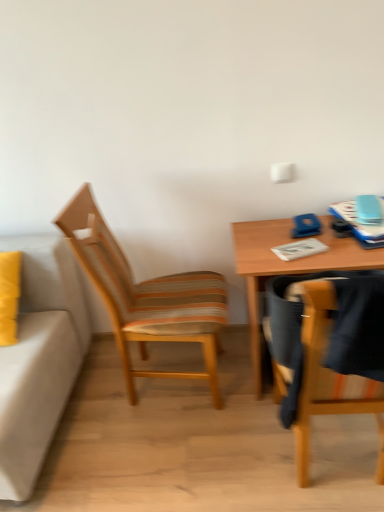
Locate an element on the screen. free location to the left of woodenchair at left, the first chair when ordered from back to front is located at coordinates (90, 400).